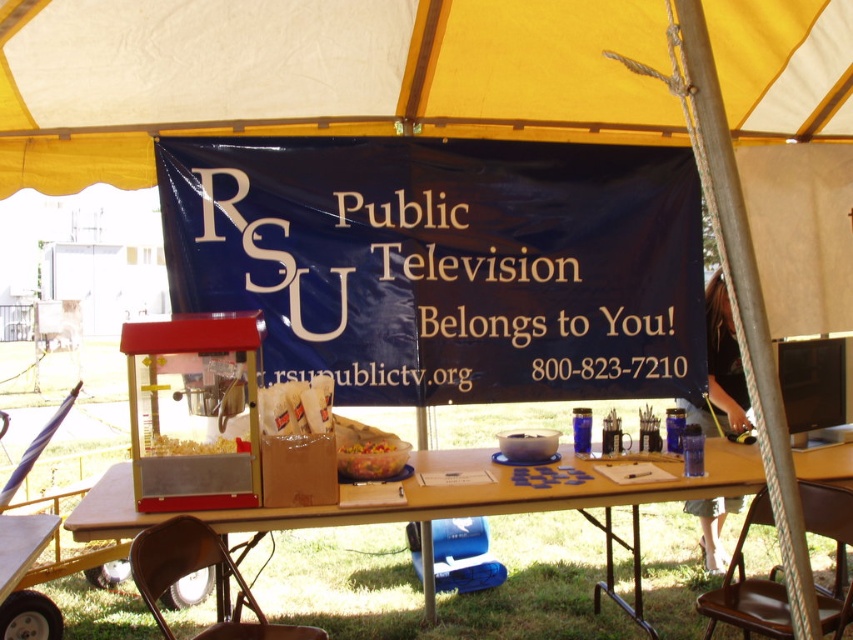
Question: Which point appears closest to the camera in this image?

Choices:
 (A) (445, 276)
 (B) (172, 448)

Answer: (B)

Question: Is yellow fabric canopy at upper center below translucent yellow popcorn at center?

Choices:
 (A) no
 (B) yes

Answer: (A)

Question: Which object is the farthest from the translucent yellow popcorn at center?

Choices:
 (A) metallic silver pen at right
 (B) translucent plastic bowl at center
 (C) yellow fabric canopy at upper center

Answer: (A)

Question: Among these objects, which one is nearest to the camera?

Choices:
 (A) metallic silver pen at right
 (B) yellow fabric canopy at upper center
 (C) translucent plastic bowl at center
 (D) wooden table at center

Answer: (D)

Question: Does blue fabric banner at center come behind translucent yellow popcorn at center?

Choices:
 (A) yes
 (B) no

Answer: (A)

Question: Can you confirm if blue fabric banner at center is thinner than metallic silver pen at right?

Choices:
 (A) no
 (B) yes

Answer: (A)